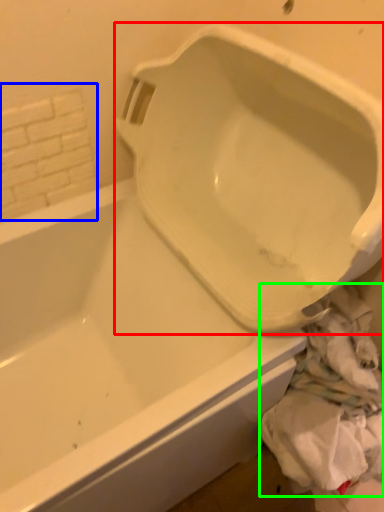
Question: Estimate the real-world distances between objects in this image. Which object is farther from urinal (highlighted by a red box), tile (highlighted by a blue box) or material (highlighted by a green box)?

Choices:
 (A) tile
 (B) material

Answer: (A)